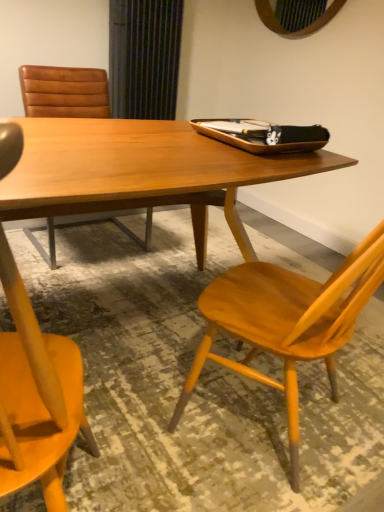
What are the coordinates of `free space above wooden table at center (from a real-world perspective)` in the screenshot? It's located at (129, 142).